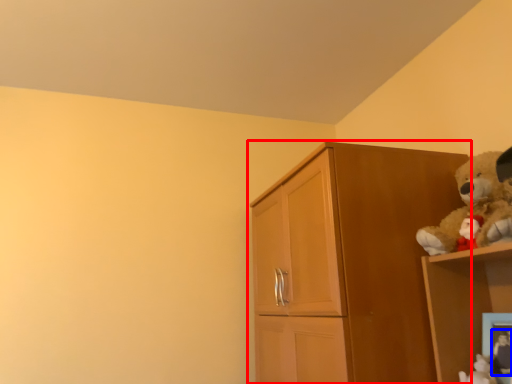
Question: Which point is further to the camera, cupboard (highlighted by a red box) or toy (highlighted by a blue box)?

Choices:
 (A) cupboard
 (B) toy

Answer: (A)